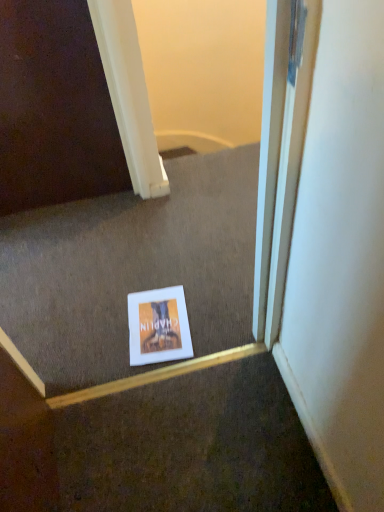
Question: Considering the positions of matte cardboard book at center and white paper at center in the image, is matte cardboard book at center taller or shorter than white paper at center?

Choices:
 (A) short
 (B) tall

Answer: (A)

Question: Considering the positions of matte cardboard book at center and white paper at center in the image, is matte cardboard book at center wider or thinner than white paper at center?

Choices:
 (A) thin
 (B) wide

Answer: (A)

Question: Is matte cardboard book at center in front of or behind white paper at center in the image?

Choices:
 (A) front
 (B) behind

Answer: (B)

Question: Based on their sizes in the image, would you say white paper at center is bigger or smaller than matte cardboard book at center?

Choices:
 (A) small
 (B) big

Answer: (B)

Question: Is white paper at center inside or outside of matte cardboard book at center?

Choices:
 (A) outside
 (B) inside

Answer: (A)

Question: Would you say white paper at center is to the left or to the right of matte cardboard book at center in the picture?

Choices:
 (A) right
 (B) left

Answer: (B)

Question: Is white paper at center taller or shorter than matte cardboard book at center?

Choices:
 (A) tall
 (B) short

Answer: (A)